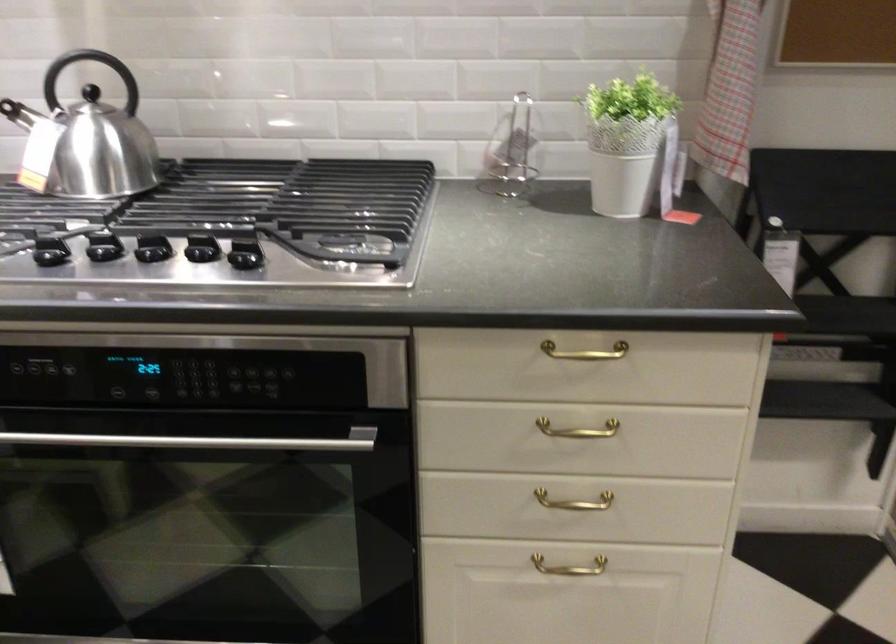
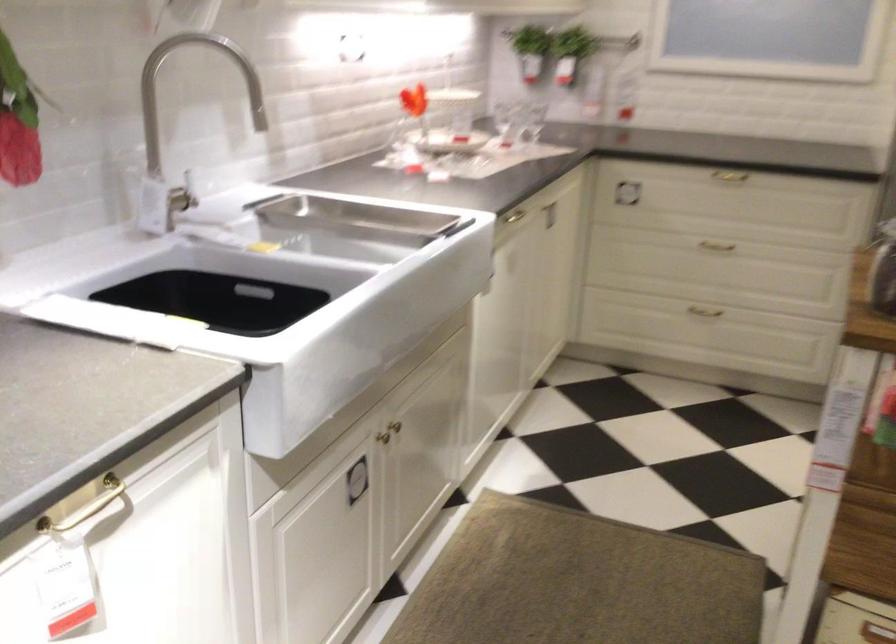
How did the camera likely rotate?

The rotation direction of the camera is left-down.